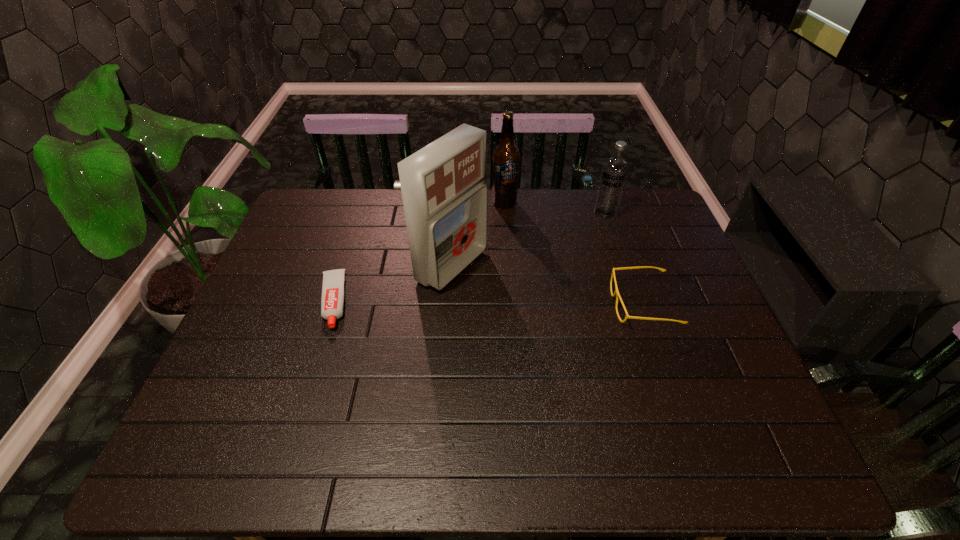
Locate an element on the screen. free space located on the front-facing side of the first-aid kit is located at coordinates (549, 319).

Locate an element on the screen. This screenshot has width=960, height=540. vodka situated at the far edge is located at coordinates pyautogui.click(x=615, y=169).

Where is `beer bottle present at the far edge`? beer bottle present at the far edge is located at coordinates (506, 157).

Find the location of a particular element. The image size is (960, 540). spectacles at the right edge is located at coordinates (616, 293).

Identify the location of vodka situated at the right edge. click(615, 169).

Where is `object that is at the far right corner`? The width and height of the screenshot is (960, 540). object that is at the far right corner is located at coordinates (615, 169).

Locate an element on the screen. vacant space at the far edge is located at coordinates (562, 210).

The image size is (960, 540). I want to click on blank space at the near edge of the desktop, so click(x=464, y=413).

You are a GUI agent. You are given a task and a screenshot of the screen. Output one action in this format:
    pyautogui.click(x=<x>, y=<y>)
    Task: Click on the vacant region at the left edge of the desktop
    Image resolution: width=960 pixels, height=540 pixels.
    Given the screenshot: What is the action you would take?
    pyautogui.click(x=322, y=273)

In the image, there is a desktop. At what (x,y) coordinates should I click in order to perform the action: click on vacant space at the right edge. Please return your answer as a coordinate pair (x, y). The width and height of the screenshot is (960, 540). Looking at the image, I should click on (666, 247).